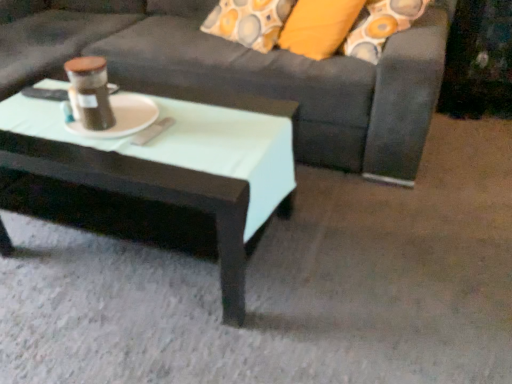
Locate an element on the screen. vacant region to the left of white matte platter at center is located at coordinates (32, 125).